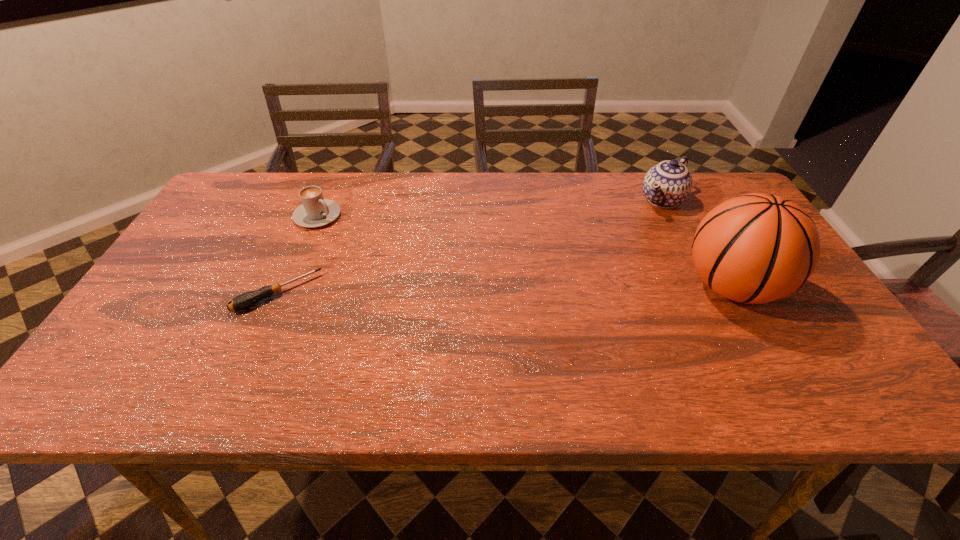
You are a GUI agent. You are given a task and a screenshot of the screen. Output one action in this format:
    pyautogui.click(x=<x>, y=<y>)
    Task: Click on the shortest object
    
    Given the screenshot: What is the action you would take?
    pyautogui.click(x=243, y=301)

Locate an element on the screen. This screenshot has height=540, width=960. the tallest object is located at coordinates (755, 248).

You are a GUI agent. You are given a task and a screenshot of the screen. Output one action in this format:
    pyautogui.click(x=<x>, y=<y>)
    Task: Click on the third shortest object
    
    Given the screenshot: What is the action you would take?
    pyautogui.click(x=668, y=184)

You are a GUI agent. You are given a task and a screenshot of the screen. Output one action in this format:
    pyautogui.click(x=<x>, y=<y>)
    Task: Click on the cappuccino
    The width and height of the screenshot is (960, 540).
    Given the screenshot: What is the action you would take?
    pyautogui.click(x=315, y=211)

The width and height of the screenshot is (960, 540). Find the location of `free space located on the back of the shortest object`. free space located on the back of the shortest object is located at coordinates (322, 193).

This screenshot has height=540, width=960. I want to click on vacant region located 0.060m on the front of the basketball, so click(x=765, y=348).

In order to click on free location located at the spout of the chinaware in this screenshot , I will do `click(578, 281)`.

This screenshot has width=960, height=540. Identify the location of vacant region located 0.290m at the spout of the chinaware. (597, 263).

This screenshot has width=960, height=540. I want to click on free location located 0.270m at the spout of the chinaware, so click(602, 259).

This screenshot has width=960, height=540. Identify the location of free location located 0.190m to the right of the third tallest object. (381, 251).